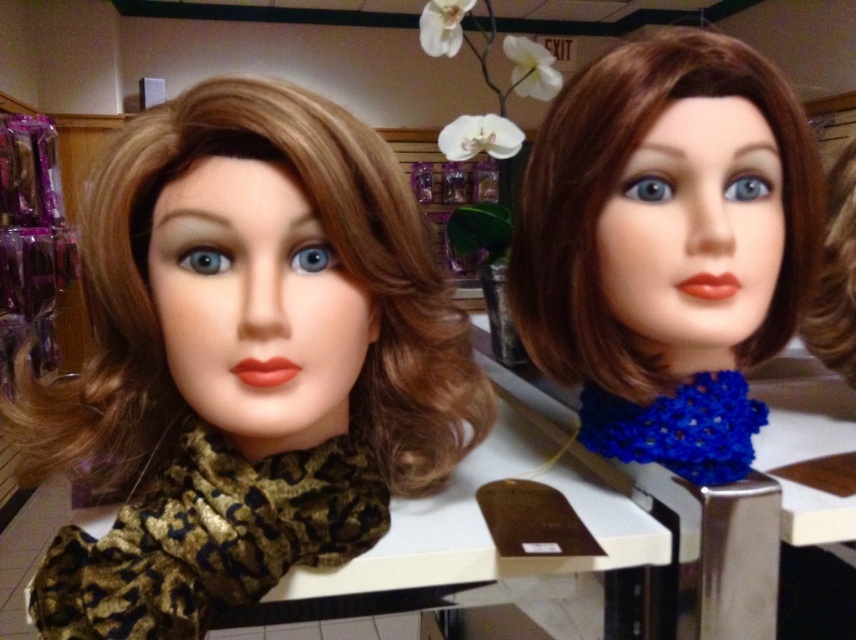
Can you confirm if brownleather-likewig at left is shorter than metallic silver table at center?

Correct, brownleather-likewig at left is not as tall as metallic silver table at center.

Between brownleather-likewig at left and metallic silver table at center, which one appears on the left side from the viewer's perspective?

From the viewer's perspective, brownleather-likewig at left appears more on the left side.

Between point (159, 108) and point (823, 515), which one is positioned behind?

The point (823, 515) is more distant.

Locate an element on the screen. Image resolution: width=856 pixels, height=640 pixels. brownleather-likewig at left is located at coordinates coord(307,262).

Describe the element at coordinates (747, 554) in the screenshot. The width and height of the screenshot is (856, 640). I see `metallic silver table at center` at that location.

Between metallic silver table at center and brown silky hair at upper right, which one is positioned higher?

brown silky hair at upper right

Who is more distant from viewer, [698,611] or [827,177]?

The point [827,177] is behind.

Locate an element on the screen. metallic silver table at center is located at coordinates (747, 554).

Is point (809, 138) closer to viewer compared to point (843, 193)?

Yes, point (809, 138) is closer to viewer.

Can you confirm if brown matte wig at upper right is positioned to the right of brown silky hair at upper right?

No, brown matte wig at upper right is not to the right of brown silky hair at upper right.

Which is in front, point (608, 332) or point (840, 208)?

Point (608, 332) is more forward.

Image resolution: width=856 pixels, height=640 pixels. In order to click on brown matte wig at upper right in this screenshot , I will do `click(611, 186)`.